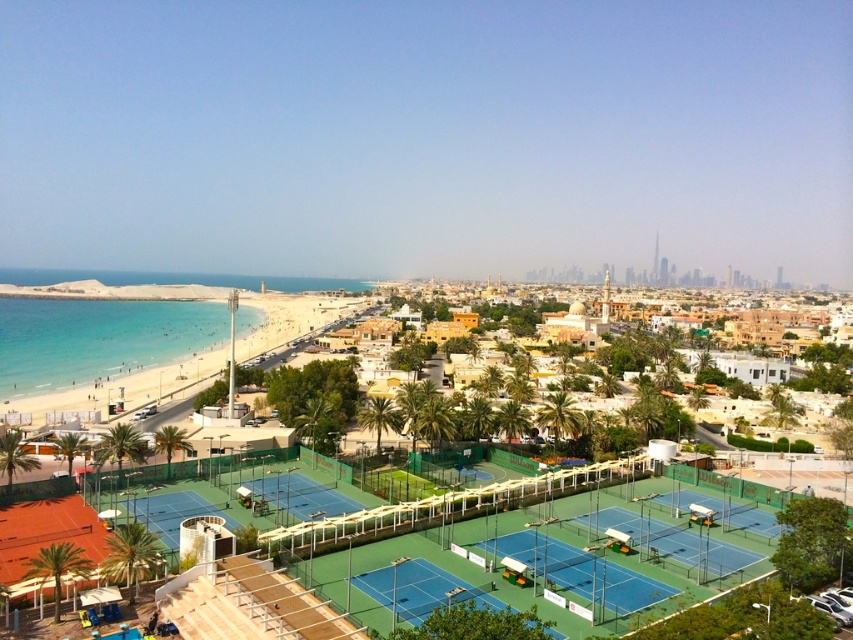
You are standing on the smooth sand beach at lower left and want to see the green synthetic turf tennis courts at center. Is the beach blocking your view of the courts?

The smooth sand beach at lower left is much taller than the green synthetic turf tennis courts at center, so the beach might block your view of the courts.

You are planning to host a beach volleyball tournament and need a large open space. Given the scene, can the smooth sand beach at lower left accommodate more players and equipment than the green synthetic turf tennis courts at center?

The smooth sand beach at lower left has a larger size compared to the green synthetic turf tennis courts at center, so yes, it can accommodate more players and equipment.

You are a groundskeeper responsible for maintaining the tennis courts. You need to replace the turf on the narrower court. Which one should you choose between the green synthetic turf tennis courts at center and the green synthetic turf tennis court at lower left?

The green synthetic turf tennis courts at center is thinner than the green synthetic turf tennis court at lower left, so you should choose the green synthetic turf tennis courts at center for replacement since it is the narrower one.